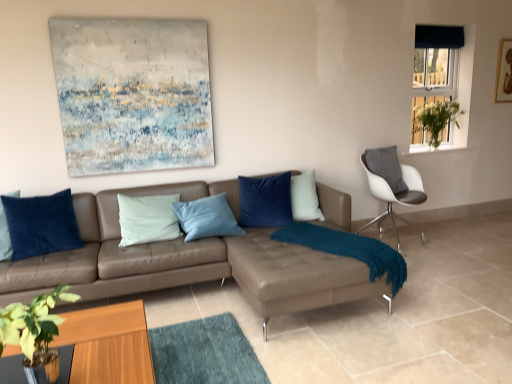
Question: Is brown leather couch at center at the right side of white glossy chair at right?

Choices:
 (A) no
 (B) yes

Answer: (A)

Question: From a real-world perspective, is brown leather couch at center positioned under white glossy chair at right based on gravity?

Choices:
 (A) yes
 (B) no

Answer: (A)

Question: Is brown leather couch at center shorter than white glossy chair at right?

Choices:
 (A) no
 (B) yes

Answer: (B)

Question: Are brown leather couch at center and white glossy chair at right beside each other?

Choices:
 (A) yes
 (B) no

Answer: (B)

Question: Is brown leather couch at center further to camera compared to white glossy chair at right?

Choices:
 (A) no
 (B) yes

Answer: (A)

Question: From a real-world perspective, is brown leather couch at center located higher than white glossy chair at right?

Choices:
 (A) no
 (B) yes

Answer: (A)

Question: Would you say brown leather footrest at center contains dark blue velvet curtain at upper right?

Choices:
 (A) no
 (B) yes

Answer: (A)

Question: Is brown leather footrest at center thinner than dark blue velvet curtain at upper right?

Choices:
 (A) yes
 (B) no

Answer: (B)

Question: Is brown leather footrest at center completely or partially outside of dark blue velvet curtain at upper right?

Choices:
 (A) no
 (B) yes

Answer: (B)

Question: Is there a large distance between brown leather footrest at center and dark blue velvet curtain at upper right?

Choices:
 (A) no
 (B) yes

Answer: (B)

Question: Does brown leather footrest at center have a greater width compared to dark blue velvet curtain at upper right?

Choices:
 (A) no
 (B) yes

Answer: (B)

Question: Are brown leather footrest at center and dark blue velvet curtain at upper right beside each other?

Choices:
 (A) yes
 (B) no

Answer: (B)

Question: Is the position of white glossy chair at right more distant than that of blue fabric curtain at upper right?

Choices:
 (A) no
 (B) yes

Answer: (A)